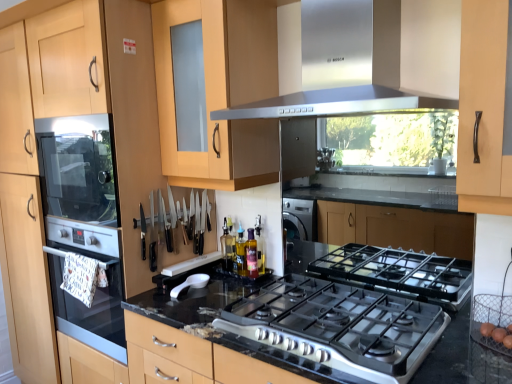
Locate an element on the screen. The height and width of the screenshot is (384, 512). blank space to the left of translucent glass bottle at center, which ranks as the second bottle in left-to-right order is located at coordinates (231, 284).